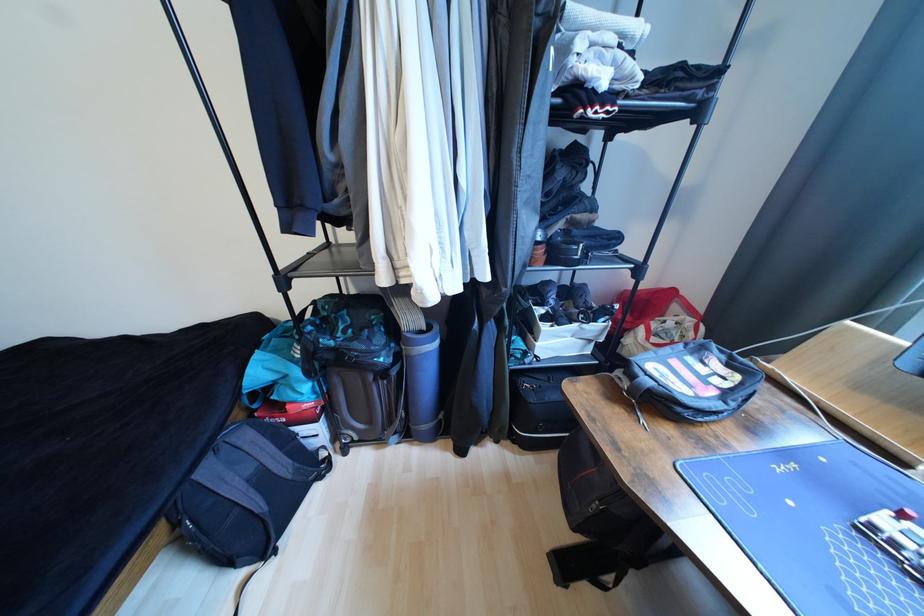
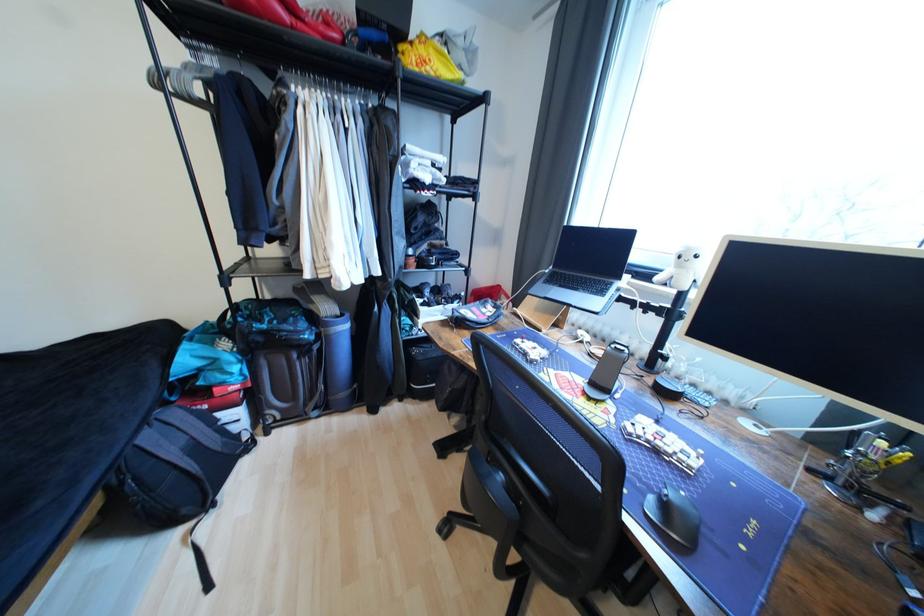
Where in the second image is the point corresponding to point 215,472 from the first image?

(155, 439)